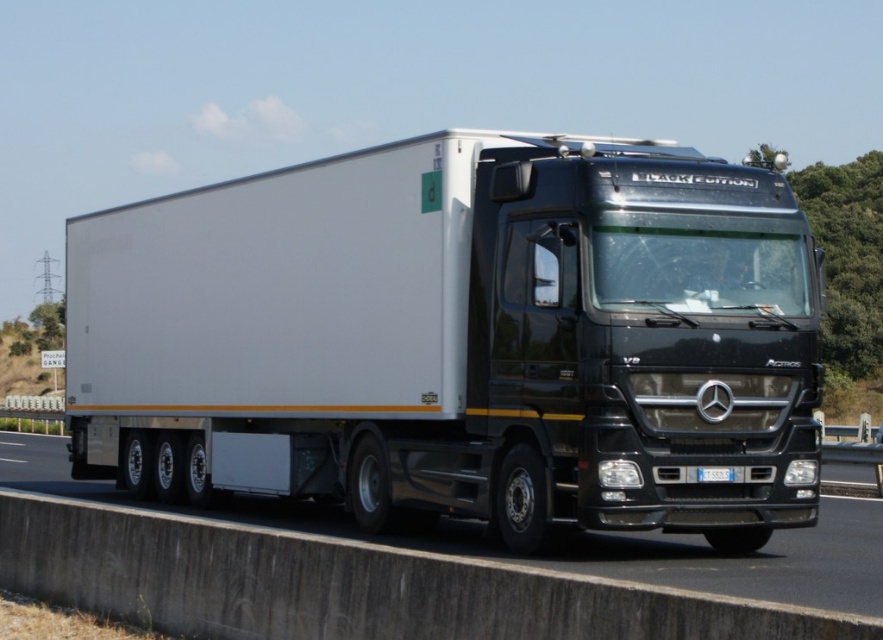
From the picture: Is the position of white glossy trailer at center more distant than that of black glossy truck at center?

Yes, it is.

Who is positioned more to the right, white glossy trailer at center or black glossy truck at center?

From the viewer's perspective, white glossy trailer at center appears more on the right side.

The height and width of the screenshot is (640, 883). Identify the location of white glossy trailer at center. (461, 339).

Based on the photo, measure the distance between point [193,353] and camera.

The distance of point [193,353] from camera is 15.78 meters.

Can you confirm if white glossy trailer at center is shorter than white plastic license plate at center?

No, white glossy trailer at center is not shorter than white plastic license plate at center.

Who is more forward, (328, 291) or (730, 476)?

Point (730, 476) is in front.

The image size is (883, 640). What are the coordinates of `white glossy trailer at center` in the screenshot? It's located at click(x=461, y=339).

Is point (466, 538) farther from viewer compared to point (704, 467)?

Yes, it is.

In the scene shown: Is black glossy truck at center to the left of white plastic license plate at center from the viewer's perspective?

Yes, black glossy truck at center is to the left of white plastic license plate at center.

Is point (12, 461) behind point (733, 474)?

That is True.

Find the location of a particular element. This screenshot has height=640, width=883. black glossy truck at center is located at coordinates (557, 554).